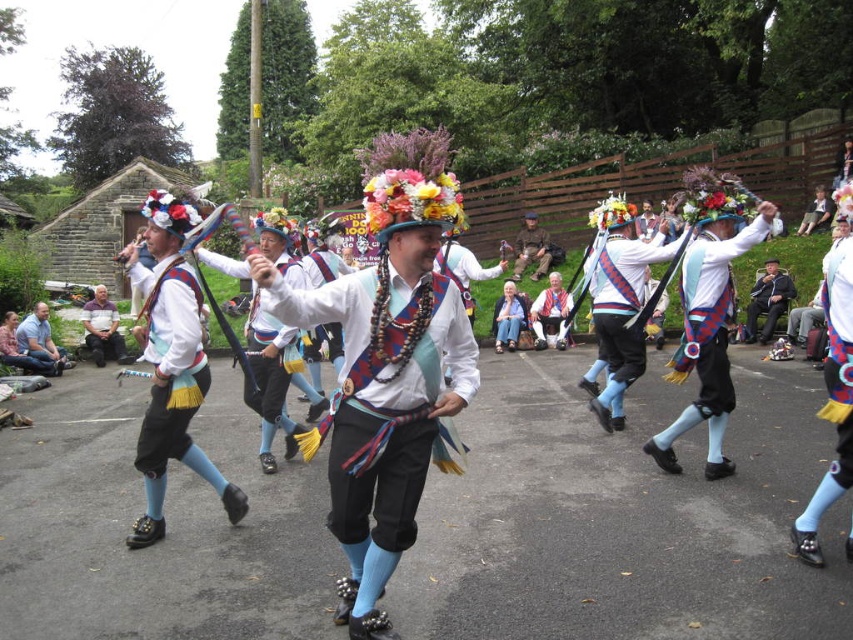
Question: Does dark blue fabric hat at center appear on the left side of brown fabric jacket at center?

Choices:
 (A) no
 (B) yes

Answer: (A)

Question: Which is farther from the brown fabric jacket at center?

Choices:
 (A) matte black pants at left
 (B) dark blue fabric hat at center

Answer: (A)

Question: Is dark blue fabric hat at center bigger than light purple cotton shirt at lower left?

Choices:
 (A) yes
 (B) no

Answer: (B)

Question: Which point appears farthest from the camera in this image?

Choices:
 (A) (752, 285)
 (B) (30, 326)
 (C) (534, 260)

Answer: (C)

Question: Is dark blue fabric hat at center to the left of matte white shirt at center from the viewer's perspective?

Choices:
 (A) no
 (B) yes

Answer: (A)

Question: Which of the following is the closest to the observer?

Choices:
 (A) dark blue fabric hat at center
 (B) matte black pants at left
 (C) light purple cotton shirt at lower left

Answer: (B)